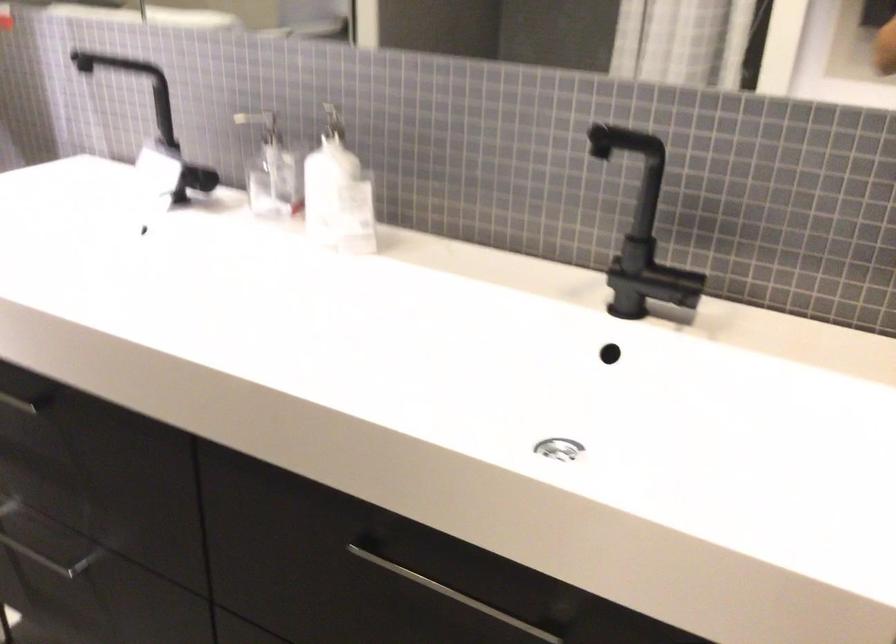
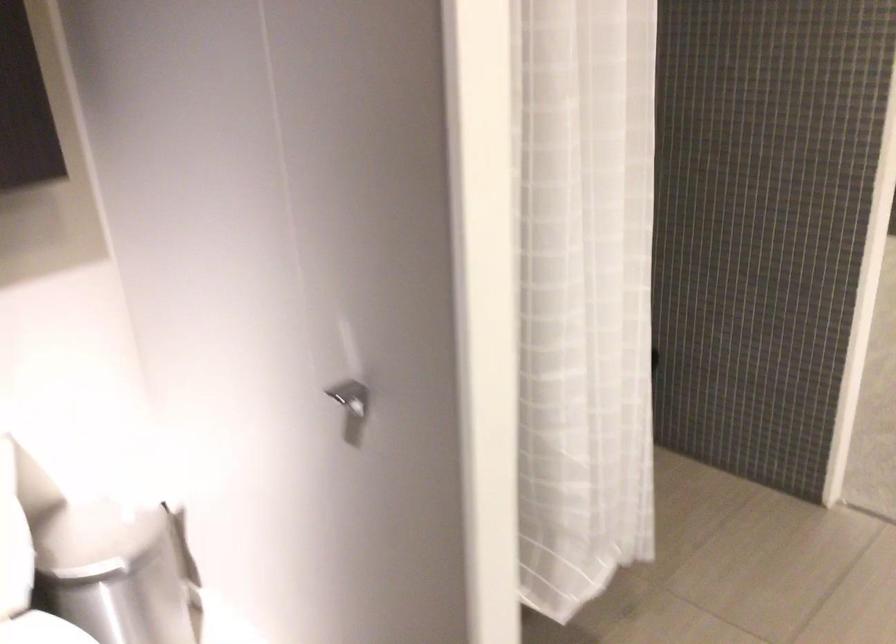
Based on the continuous images, in which direction is the camera rotating?

The camera's rotation is toward left-down.